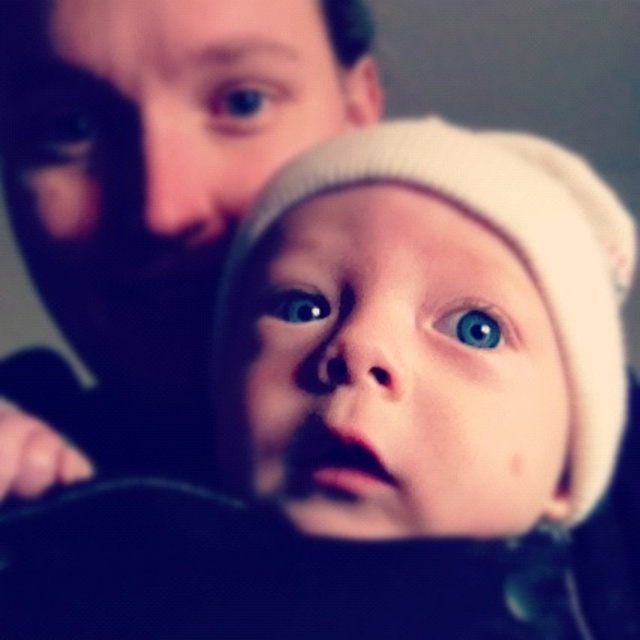
Is matte black eye at upper left shorter than blue matte eye at center?

No.

Which is below, matte black eye at upper left or blue matte eye at center?

blue matte eye at center is below.

Who is more distant from viewer, (74, 140) or (461, 323)?

Point (74, 140)

At what (x,y) coordinates should I click in order to perform the action: click on matte black eye at upper left. Please return your answer as a coordinate pair (x, y). Image resolution: width=640 pixels, height=640 pixels. Looking at the image, I should click on (64, 132).

Is blue matte eye at upper center thinner than blue matte eye at center?

In fact, blue matte eye at upper center might be wider than blue matte eye at center.

Does blue matte eye at upper center have a lesser height compared to blue matte eye at center?

No, blue matte eye at upper center is not shorter than blue matte eye at center.

Identify the location of blue matte eye at upper center. The image size is (640, 640). (243, 102).

Is blue matte eye at center thinner than blue glossy eye at center?

In fact, blue matte eye at center might be wider than blue glossy eye at center.

Is point (454, 308) in front of point (314, 317)?

Yes, point (454, 308) is closer to viewer.

Locate an element on the screen. This screenshot has width=640, height=640. blue matte eye at center is located at coordinates (472, 326).